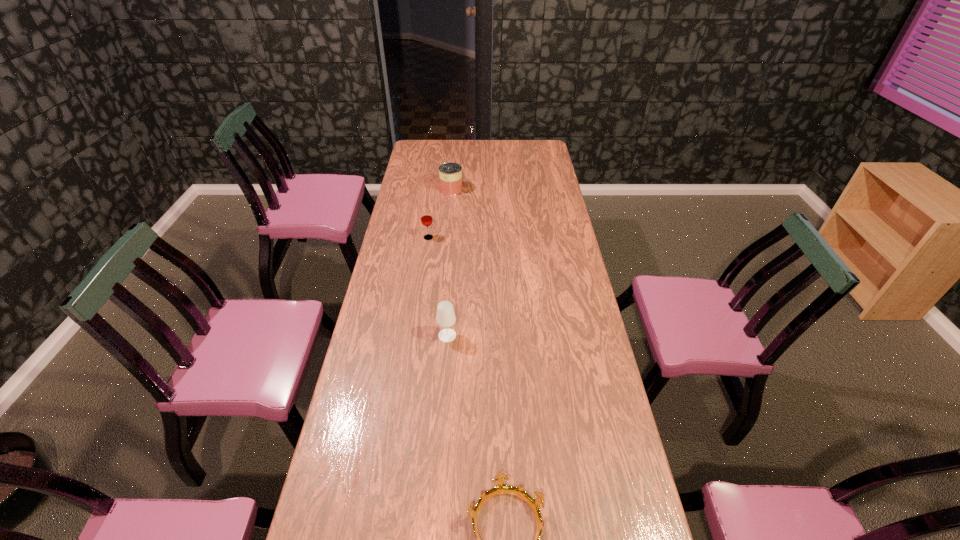
Image resolution: width=960 pixels, height=540 pixels. Identify the location of the right glass. (445, 318).

Locate an element on the screen. Image resolution: width=960 pixels, height=540 pixels. the nearer glass is located at coordinates (445, 318).

Locate an element on the screen. The height and width of the screenshot is (540, 960). the left glass is located at coordinates (426, 217).

This screenshot has width=960, height=540. Identify the location of the farther glass. (426, 217).

Where is `can`? The width and height of the screenshot is (960, 540). can is located at coordinates (450, 174).

You are a GUI agent. You are given a task and a screenshot of the screen. Output one action in this format:
    pyautogui.click(x=<x>, y=<y>)
    Task: Click on the free space located 0.370m on the right of the right glass
    The width and height of the screenshot is (960, 540).
    Given the screenshot: What is the action you would take?
    pyautogui.click(x=565, y=335)

Identify the location of vacant region located on the front of the third nearest object. The image size is (960, 540). (x=421, y=284).

This screenshot has width=960, height=540. In order to click on vacant space located on the front of the farthest object in this screenshot , I will do tap(449, 209).

Where is `object that is positioned at the left edge`? This screenshot has height=540, width=960. object that is positioned at the left edge is located at coordinates (426, 217).

In the image, there is a desktop. Where is `vacant space at the far edge`? vacant space at the far edge is located at coordinates (461, 154).